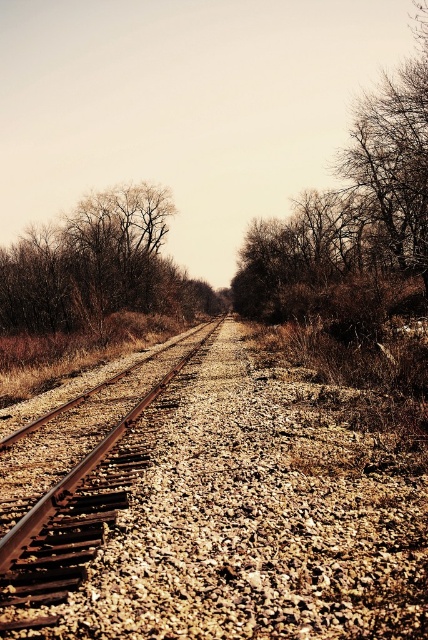
Does bare branches at center have a greater height compared to bare branches at upper left?

Yes, bare branches at center is taller than bare branches at upper left.

Can you confirm if bare branches at center is shorter than bare branches at upper left?

In fact, bare branches at center may be taller than bare branches at upper left.

Does point (252, 275) come in front of point (125, 282)?

No, it is behind (125, 282).

Locate an element on the screen. The height and width of the screenshot is (640, 428). bare branches at center is located at coordinates (350, 208).

Is bare branches at upper left shorter than rusty metal train track at center?

No, bare branches at upper left is not shorter than rusty metal train track at center.

Which is behind, point (59, 298) or point (95, 460)?

Positioned behind is point (59, 298).

Locate an element on the screen. bare branches at upper left is located at coordinates (98, 268).

Which is behind, point (282, 300) or point (151, 397)?

The point (282, 300) is more distant.

Based on the photo, does bare branches at center have a greater width compared to rusty metal train track at center?

Yes.

Does point (369, 120) come in front of point (27, 584)?

That is False.

At what (x,y) coordinates should I click in order to perform the action: click on bare branches at center. Please return your answer as a coordinate pair (x, y). The width and height of the screenshot is (428, 640). Looking at the image, I should click on (350, 208).